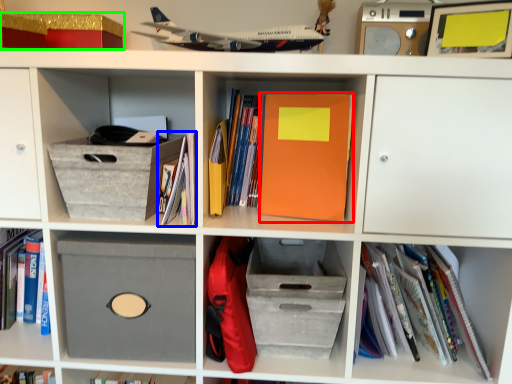
Question: Which object is positioned closest to paperback book (highlighted by a red box)? Select from book (highlighted by a blue box) and storage box (highlighted by a green box).

Choices:
 (A) book
 (B) storage box

Answer: (A)